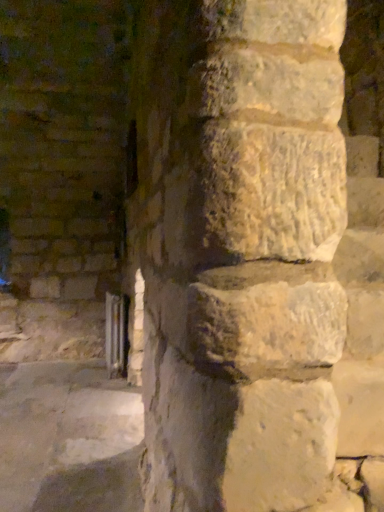
Image resolution: width=384 pixels, height=512 pixels. In order to click on clear glass window at lower left in this screenshot , I will do `click(116, 334)`.

The height and width of the screenshot is (512, 384). Describe the element at coordinates (116, 334) in the screenshot. I see `clear glass window at lower left` at that location.

Locate an element on the screen. Image resolution: width=384 pixels, height=512 pixels. clear glass window at lower left is located at coordinates (116, 334).